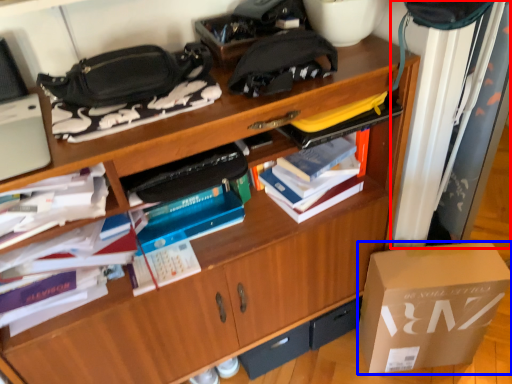
Question: Which point is closer to the camera, curtain (highlighted by a red box) or box (highlighted by a blue box)?

Choices:
 (A) curtain
 (B) box

Answer: (A)